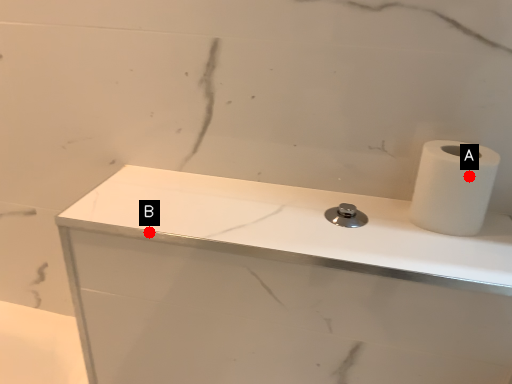
Question: Two points are circled on the image, labeled by A and B beside each circle. Which point is farther from the camera taking this photo?

Choices:
 (A) A is further
 (B) B is further

Answer: (B)